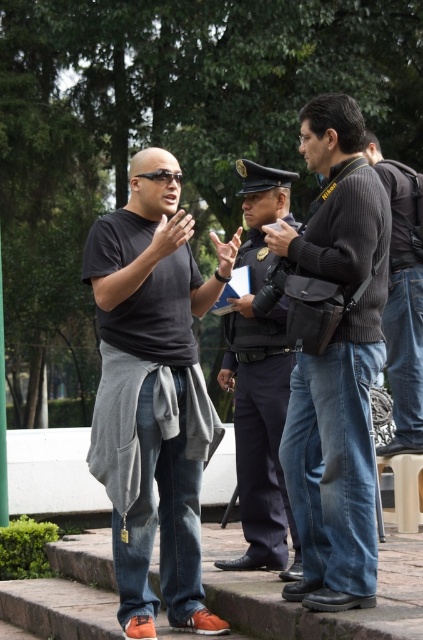
What is the exact coordinate of the dark gray sweater at center?

The dark gray sweater at center is located at point (335, 358).

You are a photographer trying to capture both the dark gray sweater at center and the dark blue uniform at center in a single frame. Given their sizes, which one should you focus on to ensure both are clearly visible in the photo?

Since the dark gray sweater at center is smaller than the dark blue uniform at center, you should focus on the dark blue uniform at center to ensure both are clearly visible in the photo.